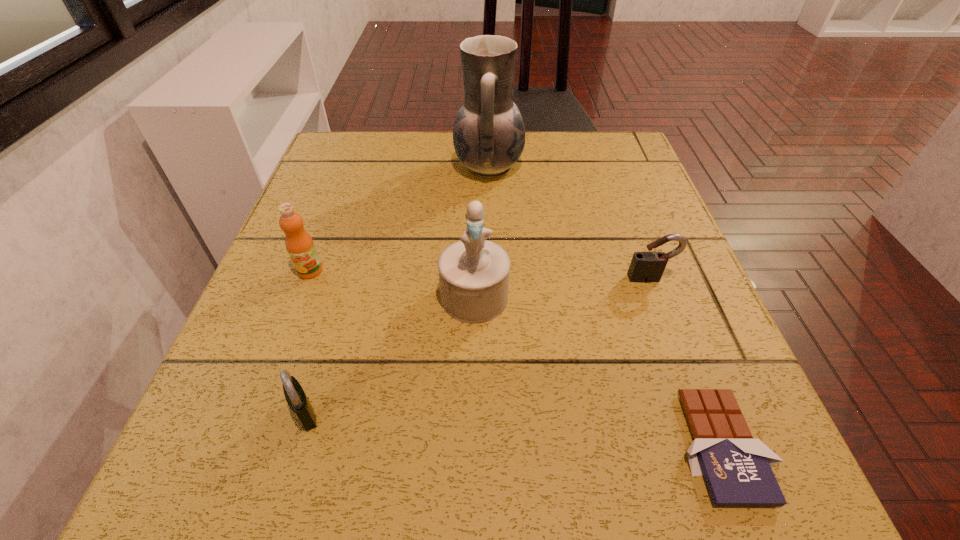
Find the location of a particular element. This screenshot has height=540, width=960. the tallest object is located at coordinates (489, 134).

Where is `the farthest object`? This screenshot has width=960, height=540. the farthest object is located at coordinates (489, 134).

The width and height of the screenshot is (960, 540). I want to click on figurine, so coord(473,273).

You are a GUI agent. You are given a task and a screenshot of the screen. Output one action in this format:
    pyautogui.click(x=<x>, y=<y>)
    Task: Click on the fourth shortest object
    
    Given the screenshot: What is the action you would take?
    pyautogui.click(x=299, y=244)

The image size is (960, 540). What are the coordinates of `orange juice` in the screenshot? It's located at (299, 244).

I want to click on the right padlock, so click(x=646, y=267).

Where is `the left padlock`? The width and height of the screenshot is (960, 540). the left padlock is located at coordinates (295, 396).

At what (x,y) coordinates should I click in order to perform the action: click on the second object from left to right. Please return your answer as a coordinate pair (x, y). Looking at the image, I should click on (295, 396).

Find the location of a particular element. The image size is (960, 540). the shortest object is located at coordinates (737, 469).

Identify the location of vacant area situated 0.070m on the front-facing side of the pitcher. This screenshot has height=540, width=960. (424, 166).